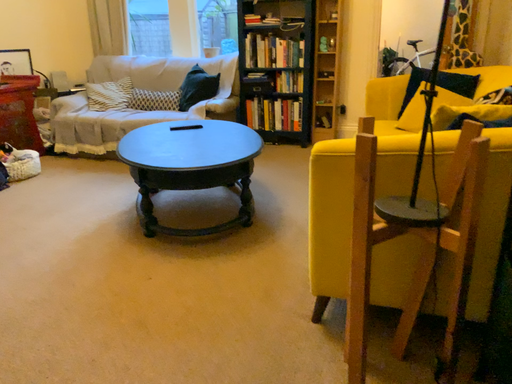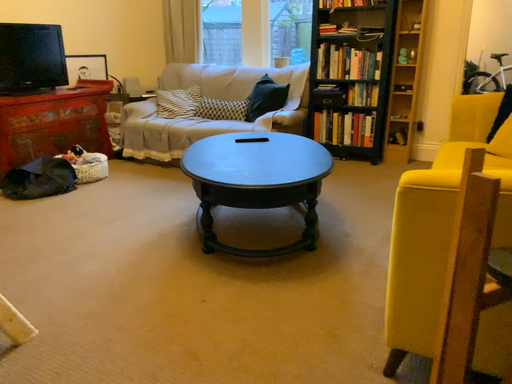
Question: How did the camera likely rotate when shooting the video?

Choices:
 (A) rotated right
 (B) rotated left

Answer: (B)